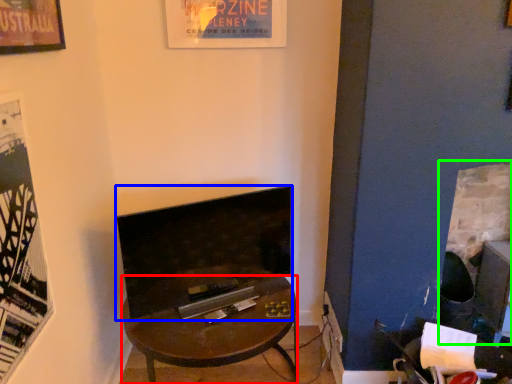
Question: Estimate the real-world distances between objects in this image. Which object is farther from desk (highlighted by a red box), fireplace (highlighted by a blue box) or fireplace (highlighted by a green box)?

Choices:
 (A) fireplace
 (B) fireplace

Answer: (B)